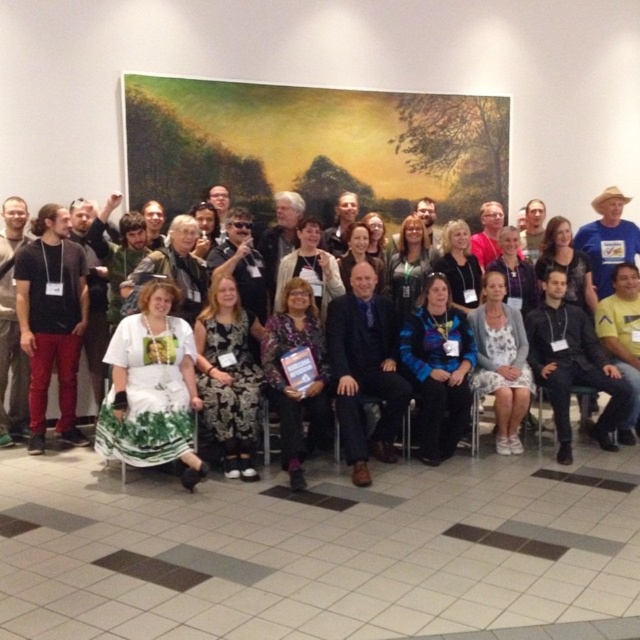
You are standing in the room where the group photo was taken. You notice two points marked in the image. The first point is at coordinates point (20, 344) and the second is at point (125, 353). Which point is closer to you?

Point (20, 344) is further to the camera than point (125, 353). Therefore, the point closer to you is point (125, 353).

You are standing in the group photo and want to find the white lace dress at center and the white printed dress at lower left. Which of these two dresses is positioned higher in the image?

The white lace dress at center is positioned higher than the white printed dress at lower left.

You are organizing a photo shoot and need to position two models wearing the white lace dress at center and the white printed dress at lower left. Based on the scene description, which model should stand to the left side of the other?

The white lace dress at center should stand to the left of the white printed dress at lower left because the white lace dress at center is to the left of white printed dress at lower left according to the description.